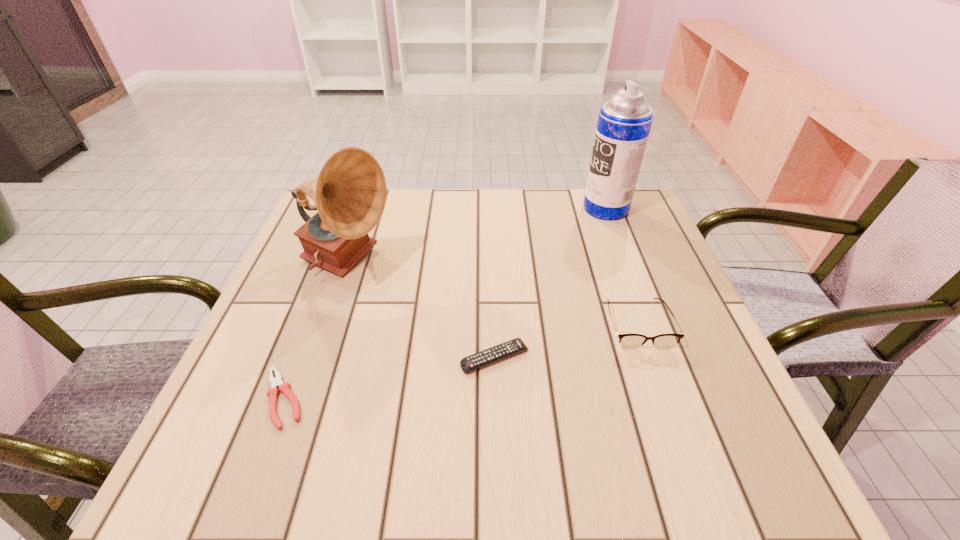
Locate an element on the screen. The image size is (960, 540). object that is at the near left corner is located at coordinates (284, 387).

Where is `object that is at the far right corner`? Image resolution: width=960 pixels, height=540 pixels. object that is at the far right corner is located at coordinates (624, 122).

I want to click on blank space at the far edge of the desktop, so click(510, 225).

The width and height of the screenshot is (960, 540). In order to click on vacant space at the near edge in this screenshot , I will do `click(579, 458)`.

This screenshot has height=540, width=960. I want to click on vacant position at the left edge of the desktop, so click(x=311, y=279).

Find the location of a particular element. The image size is (960, 540). blank space at the right edge of the desktop is located at coordinates (606, 260).

In the image, there is a desktop. Where is `vacant space at the near left corner`? The height and width of the screenshot is (540, 960). vacant space at the near left corner is located at coordinates (228, 442).

This screenshot has width=960, height=540. Identify the location of free space at the far right corner. (639, 205).

Locate an element on the screen. free spot between the phonograph record and the third shortest object is located at coordinates point(492,295).

At what (x,y) coordinates should I click in order to perform the action: click on free space between the spectacles and the aerosol can. Please return your answer as a coordinate pair (x, y). Looking at the image, I should click on (621, 266).